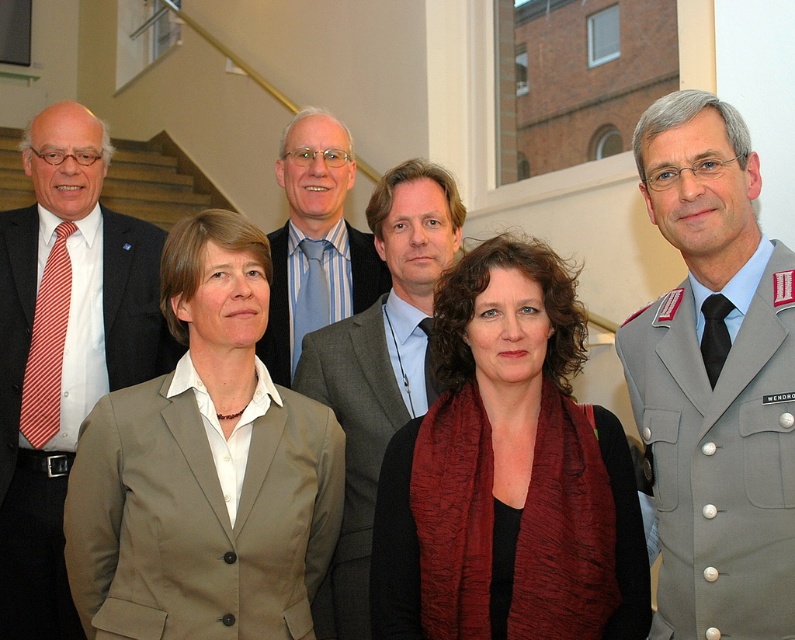
You are standing at the point with coordinates point (525, 282) and want to take a photo of the group of six individuals in the scene. If your camera is 1.83 meters away from you, will you be able to capture the entire group in the photo?

The point (525, 282) is 1.83 meters away from the camera, so yes, you can capture the entire group in the photo since the distance matches the camera range.

You are attending a formal event and notice two items at the center of the image. The first is a matte red scarf at center, and the second is a gray uniform at center. From your perspective, which item is positioned to the left?

The matte red scarf at center is to the left of the gray uniform at center.